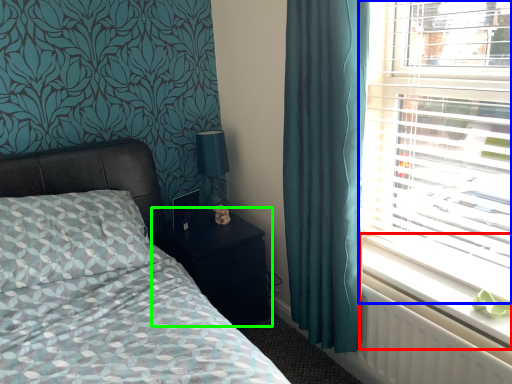
Question: Estimate the real-world distances between objects in this image. Which object is farther from window sill (highlighted by a red box), window (highlighted by a blue box) or nightstand (highlighted by a green box)?

Choices:
 (A) window
 (B) nightstand

Answer: (B)